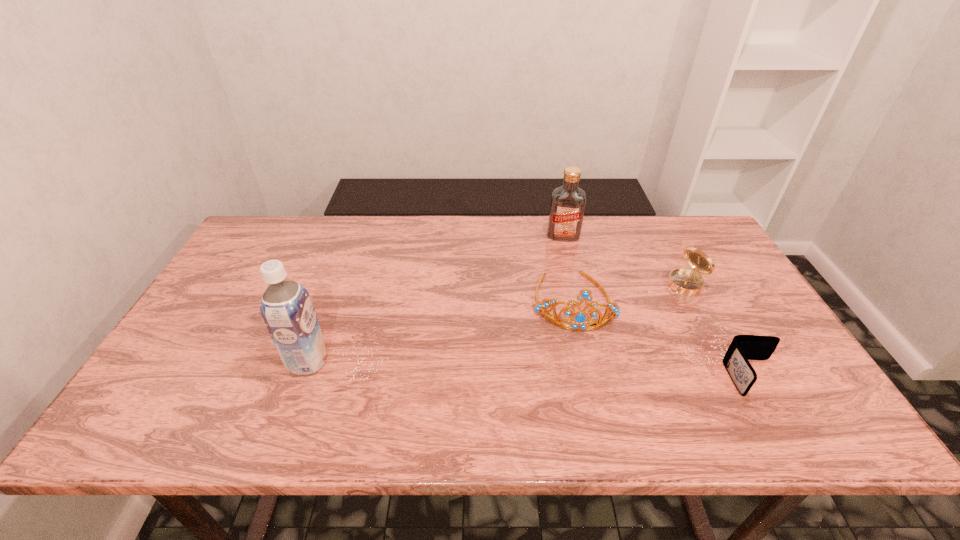
Where is `vacant space at the near left corner`? This screenshot has width=960, height=540. vacant space at the near left corner is located at coordinates (163, 373).

This screenshot has width=960, height=540. I want to click on vacant area at the far right corner, so click(651, 218).

The height and width of the screenshot is (540, 960). Identify the location of free space between the third shortest object and the leftmost object. (441, 331).

The image size is (960, 540). What are the coordinates of `empty location between the tallest object and the shortest object` in the screenshot? It's located at (531, 369).

Locate an element on the screen. The image size is (960, 540). empty space that is in between the second tallest object and the third shortest object is located at coordinates (568, 268).

Find the location of a particular element. This screenshot has width=960, height=540. vacant region between the leftmost object and the farthest object is located at coordinates (436, 299).

Locate an element on the screen. The width and height of the screenshot is (960, 540). empty space that is in between the shortest object and the compass is located at coordinates (719, 330).

Identify the location of free space that is in between the vodka and the third tallest object. [x=568, y=268].

Locate an element on the screen. unoccupied position between the farthest object and the tallest object is located at coordinates (436, 299).

Where is `vacant point located between the second tallest object and the tallest object`? This screenshot has height=540, width=960. vacant point located between the second tallest object and the tallest object is located at coordinates (436, 299).